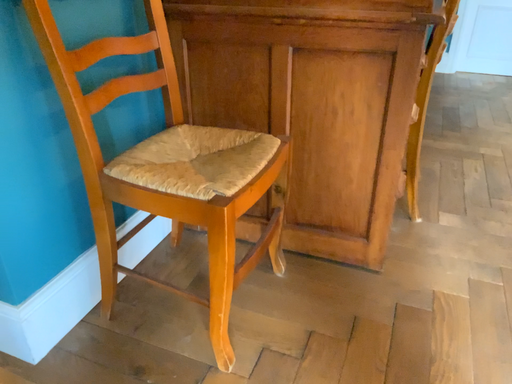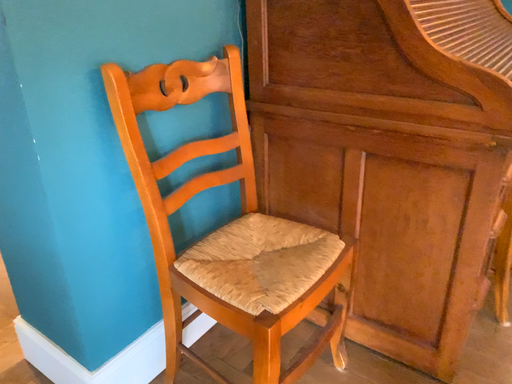
Question: Which way did the camera rotate in the video?

Choices:
 (A) rotated right
 (B) rotated left

Answer: (B)